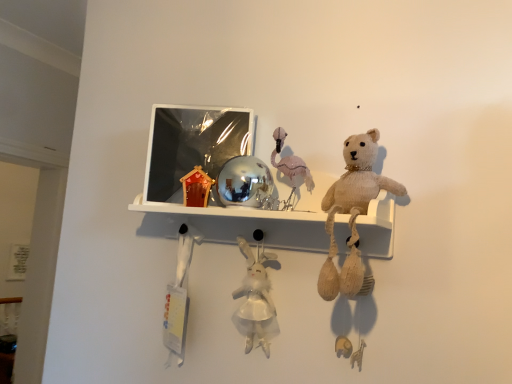
Question: Is point (203, 223) closer or farther from the camera than point (267, 279)?

Choices:
 (A) farther
 (B) closer

Answer: (A)

Question: Based on their sizes in the image, would you say shiny metallic ball at center is bigger or smaller than white plush rabbit at center, marked as the second toy in a right-to-left arrangement?

Choices:
 (A) big
 (B) small

Answer: (A)

Question: Which of these objects is positioned farthest from the metallic reflective picture frame at upper center?

Choices:
 (A) knitted beige teddy bear at upper right
 (B) white fabric toy at lower left, which is the 1th toy in left-to-right order
 (C) shiny metallic ball at center
 (D) pink fabric flamingo at center, which is the 1th toy from right to left
 (E) white plush rabbit at center, marked as the second toy in a right-to-left arrangement

Answer: (A)

Question: Which of these objects is positioned farthest from the shiny metallic ball at center?

Choices:
 (A) metallic reflective picture frame at upper center
 (B) pink fabric flamingo at center, acting as the third toy starting from the left
 (C) white fabric toy at lower left, which is the 1th toy in left-to-right order
 (D) white plush rabbit at center, marked as the second toy in a right-to-left arrangement
 (E) knitted beige teddy bear at upper right

Answer: (C)